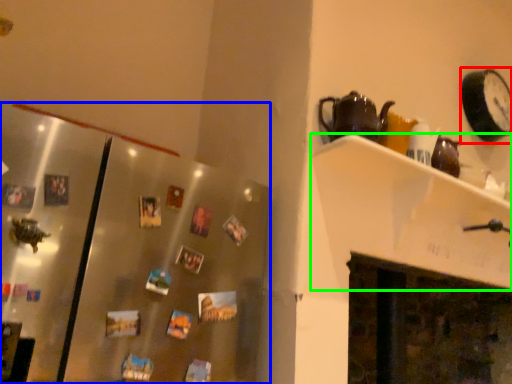
Question: Which object is positioned closest to clock (highlighted by a red box)? Select from glass door (highlighted by a blue box) and shelf (highlighted by a green box).

Choices:
 (A) glass door
 (B) shelf

Answer: (B)